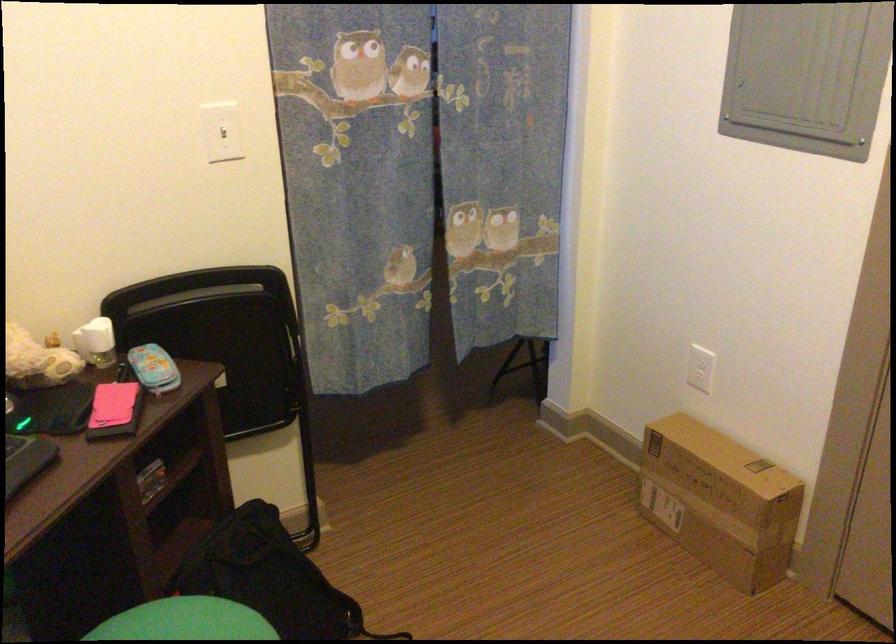
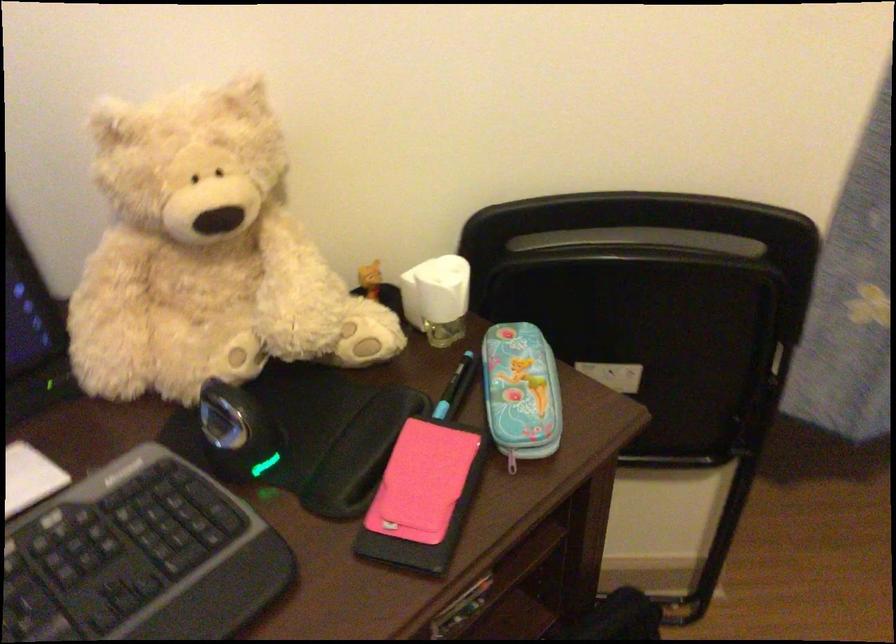
Find the pixel in the second image that matches point 96,336 in the first image.

(437, 298)